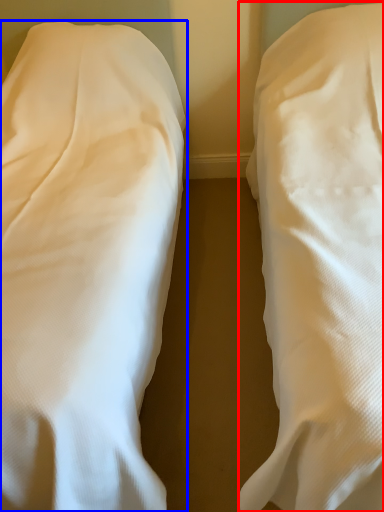
Question: Which of the following is the closest to the observer, bed (highlighted by a red box) or bed (highlighted by a blue box)?

Choices:
 (A) bed
 (B) bed

Answer: (A)